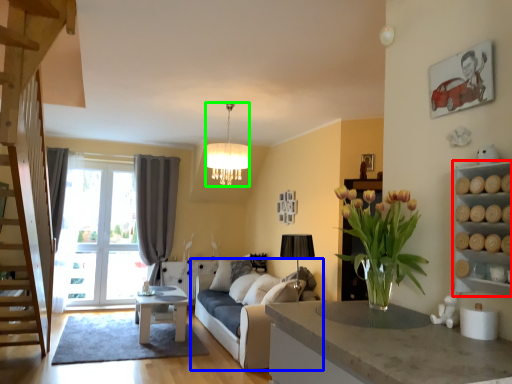
Question: Estimate the real-world distances between objects in this image. Which object is farther from cabinet (highlighted by a red box), studio couch (highlighted by a blue box) or lamp (highlighted by a green box)?

Choices:
 (A) studio couch
 (B) lamp

Answer: (A)